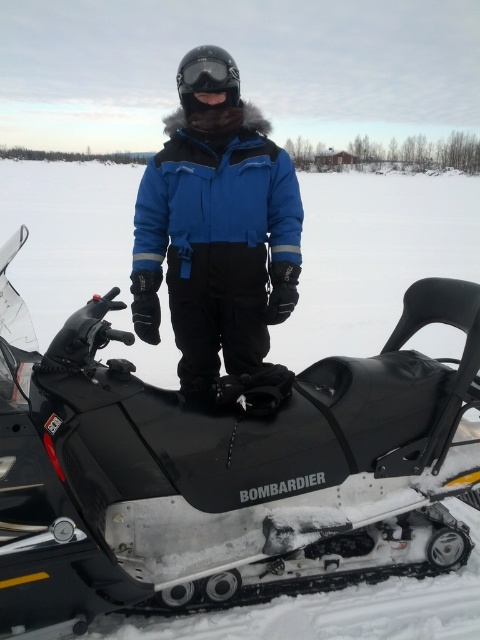
You are planning to take a photo of the black matte snowmobile at center and the black matte goggles at center. Which object should you focus on first if you want to capture both in the same frame without moving the camera?

The black matte snowmobile at center has a smaller size compared to black matte goggles at center, so you should focus on the black matte goggles at center first since it is larger and will be more prominent in the frame.

You are planning to take a photo of the snowmobile and the jacket. Since the black matte snowmobile at center and the blue synthetic jacket at center are both at the center, which one is closer to the camera?

The black matte snowmobile at center is positioned under the blue synthetic jacket at center, so the snowmobile is closer to the camera than the jacket.

Based on the photo, you are designing a winter outfit and want to ensure that the jacket and goggles are proportionate. Given the blue synthetic jacket at center and black matte goggles at center, which item has a smaller width?

The blue synthetic jacket at center has a smaller width than the black matte goggles at center according to the description.